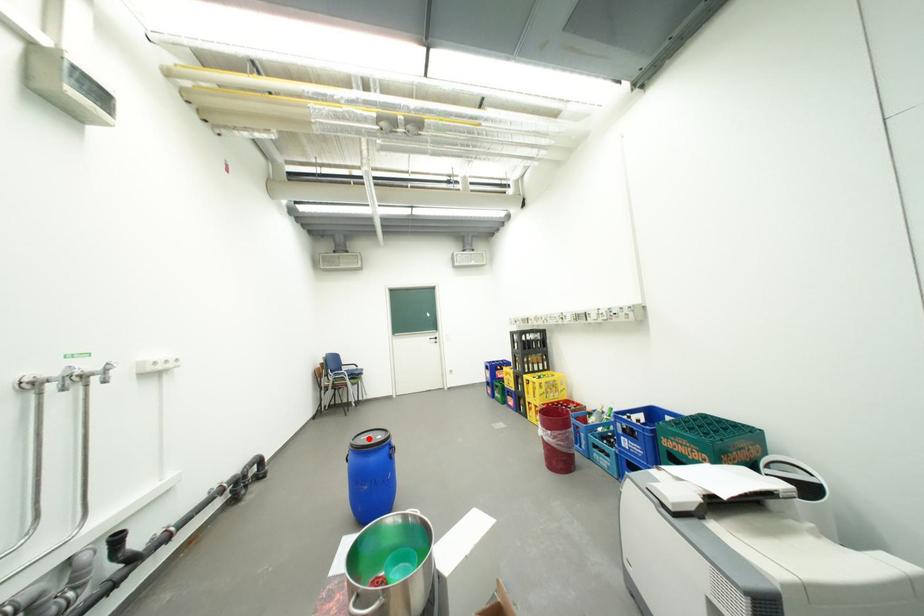
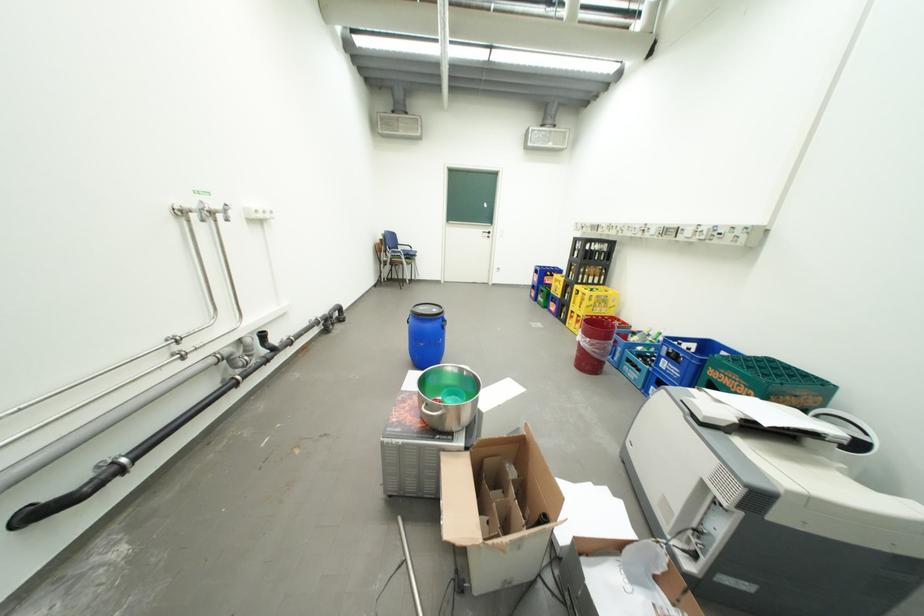
Where in the second image is the point corresponding to the highlighted location from the first image?

(428, 309)